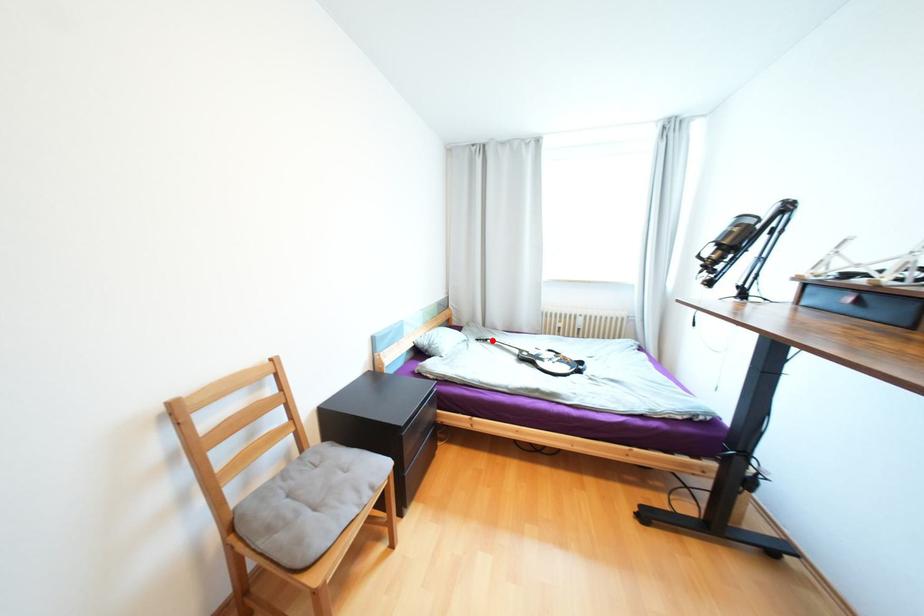
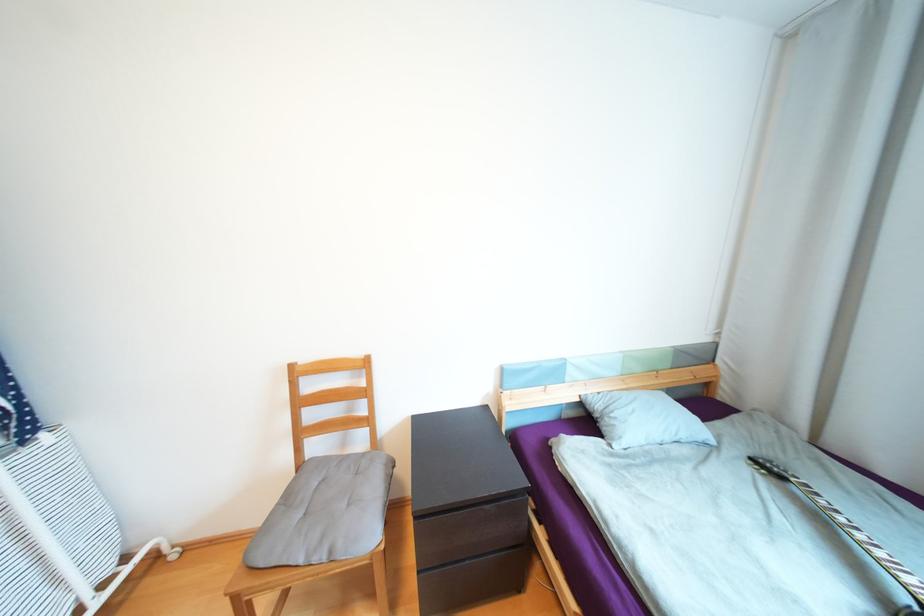
Where in the second image is the point corresponding to the highlighted location from the first image?

(787, 477)